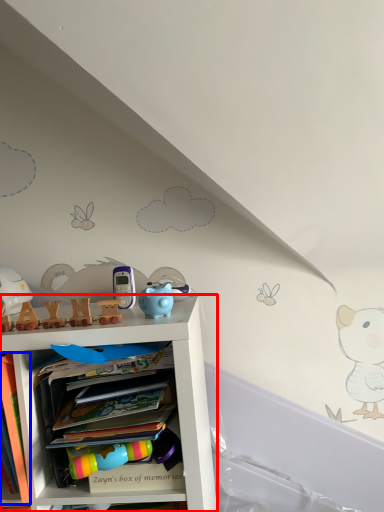
Question: Which of the following is the farthest to the observer, shelf (highlighted by a red box) or book (highlighted by a blue box)?

Choices:
 (A) shelf
 (B) book

Answer: (A)